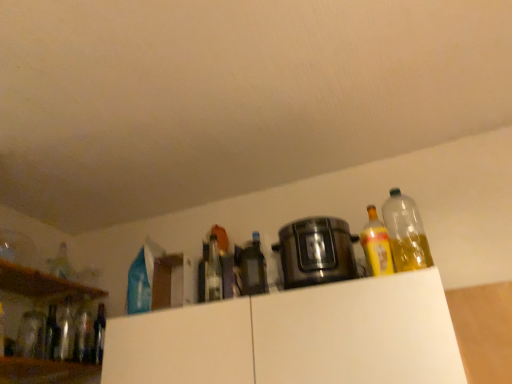
Locate an element on the screen. Image resolution: width=512 pixels, height=384 pixels. vacant space behind translucent glass bottle at left, marked as the 7th bottle in a right-to-left arrangement is located at coordinates (64, 362).